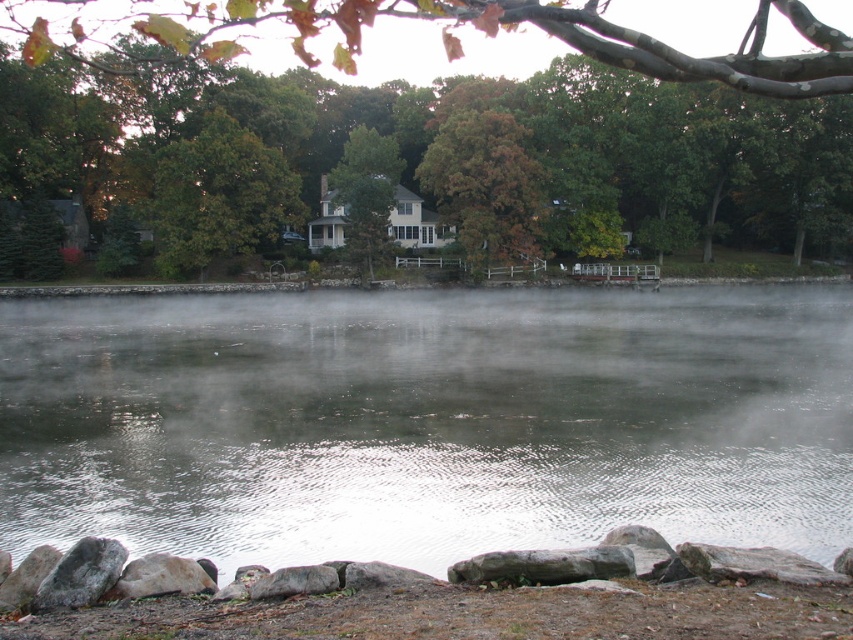
Question: Can you confirm if green leafy tree at center is thinner than gray rough stone at lower center?

Choices:
 (A) yes
 (B) no

Answer: (B)

Question: Which is farther from the brown matte tree at upper center?

Choices:
 (A) green matte tree at center
 (B) gray rough rock at lower left

Answer: (B)

Question: Which point is closer to the camera?

Choices:
 (A) translucent misty water at center
 (B) green matte tree at center

Answer: (A)

Question: Does brown matte tree at upper center appear on the right side of smooth gray rock at lower left?

Choices:
 (A) no
 (B) yes

Answer: (B)

Question: Is translucent misty water at center smaller than green leafy tree at center?

Choices:
 (A) no
 (B) yes

Answer: (A)

Question: Which of the following is the closest to the observer?

Choices:
 (A) (325, 84)
 (B) (80, 593)
 (C) (196, 433)

Answer: (B)